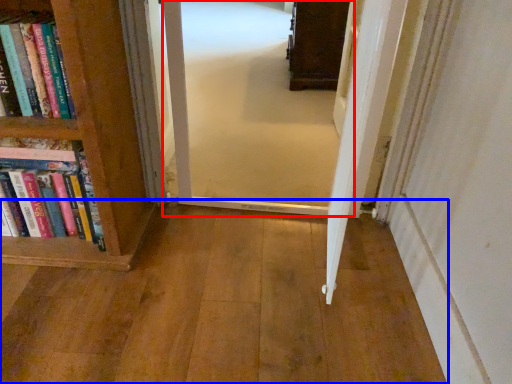
Question: Among these objects, which one is nearest to the camera, corridor (highlighted by a red box) or corridor (highlighted by a blue box)?

Choices:
 (A) corridor
 (B) corridor

Answer: (B)